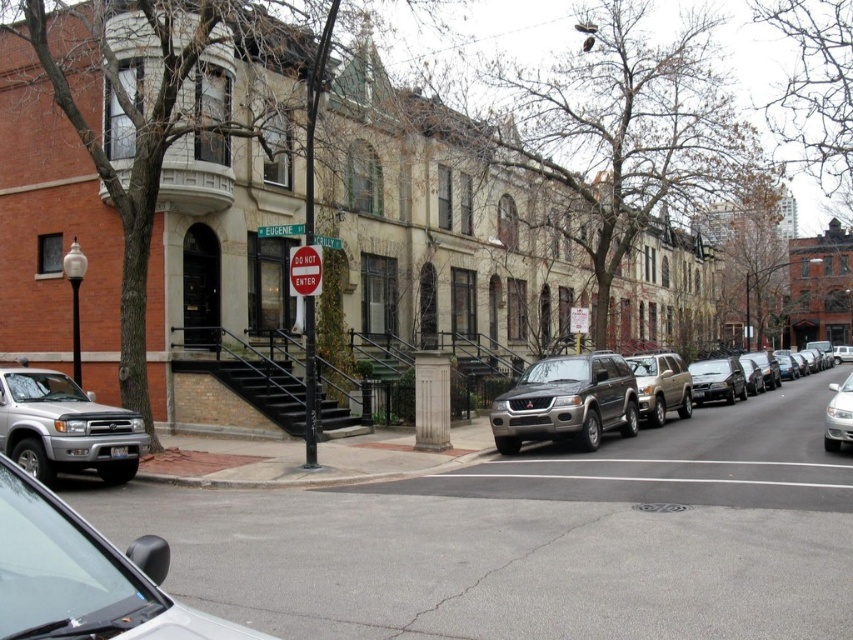
Between silver metallic suv at lower left and white glossy sedan at right, which one has more height?

white glossy sedan at right

Between silver metallic suv at lower left and white glossy sedan at right, which one has less height?

With less height is silver metallic suv at lower left.

Who is more forward, [82,467] or [850,372]?

Positioned in front is point [82,467].

I want to click on silver metallic suv at lower left, so click(x=65, y=428).

Can you confirm if metallic silver suv at center is positioned to the right of white glossy sedan at right?

No, metallic silver suv at center is not to the right of white glossy sedan at right.

Is metallic silver suv at center further to the viewer compared to white glossy sedan at right?

Yes, it is behind white glossy sedan at right.

The width and height of the screenshot is (853, 640). Identify the location of metallic silver suv at center. (567, 401).

Is silver metallic suv at lower left wider than metallic silver suv at center?

Incorrect, silver metallic suv at lower left's width does not surpass metallic silver suv at center's.

Is the position of silver metallic suv at lower left more distant than that of metallic silver suv at center?

No, silver metallic suv at lower left is in front of metallic silver suv at center.

This screenshot has width=853, height=640. Identify the location of silver metallic suv at lower left. (65, 428).